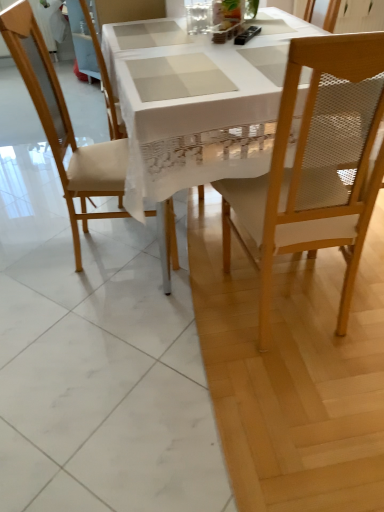
The width and height of the screenshot is (384, 512). What are the coordinates of `free location to the right of black plastic remote control at upper center` in the screenshot? It's located at (284, 32).